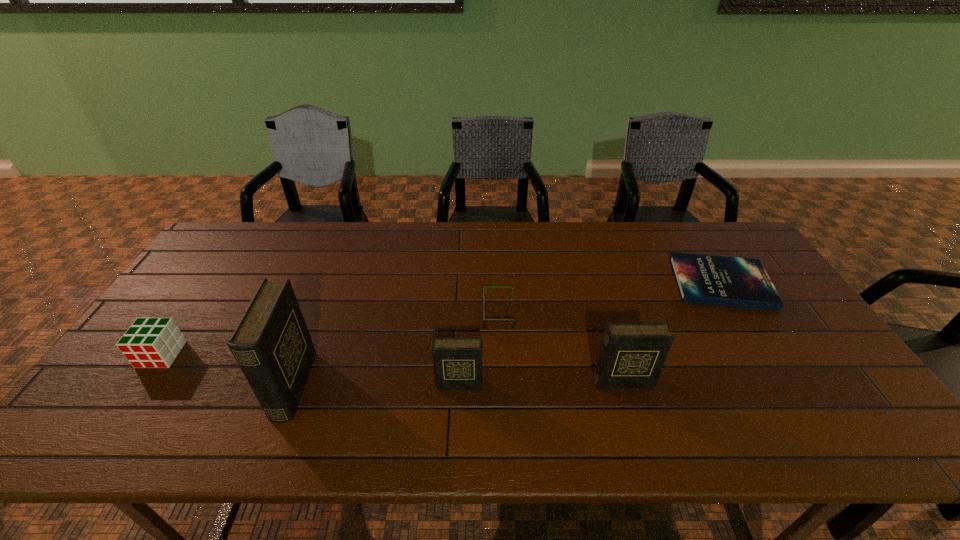
The height and width of the screenshot is (540, 960). In order to click on object located at the right edge in this screenshot , I will do `click(727, 281)`.

Identify the location of object at the far right corner. [727, 281].

Find the location of a particular element. free space at the far edge is located at coordinates (396, 224).

Locate an element on the screen. free space at the near edge of the desktop is located at coordinates (749, 390).

This screenshot has width=960, height=540. In the image, there is a desktop. Find the location of `vacant space at the right edge`. vacant space at the right edge is located at coordinates (777, 350).

This screenshot has height=540, width=960. I want to click on vacant space at the far left corner, so click(273, 221).

Where is `vacant area that lies between the second tallest diary and the hardback book`? This screenshot has width=960, height=540. vacant area that lies between the second tallest diary and the hardback book is located at coordinates (672, 332).

Where is `unoccupied area between the third object from left to right and the tallest diary`? unoccupied area between the third object from left to right and the tallest diary is located at coordinates point(376,385).

You are a GUI agent. You are given a task and a screenshot of the screen. Output one action in this format:
    pyautogui.click(x=<x>, y=<y>)
    Task: Click on the free space between the third object from left to right and the rightmost diary
    Image resolution: width=960 pixels, height=540 pixels.
    Given the screenshot: What is the action you would take?
    pyautogui.click(x=540, y=382)

Find the location of a particular element. This screenshot has height=540, width=960. vacant space that's between the leftmost object and the rightmost object is located at coordinates (441, 319).